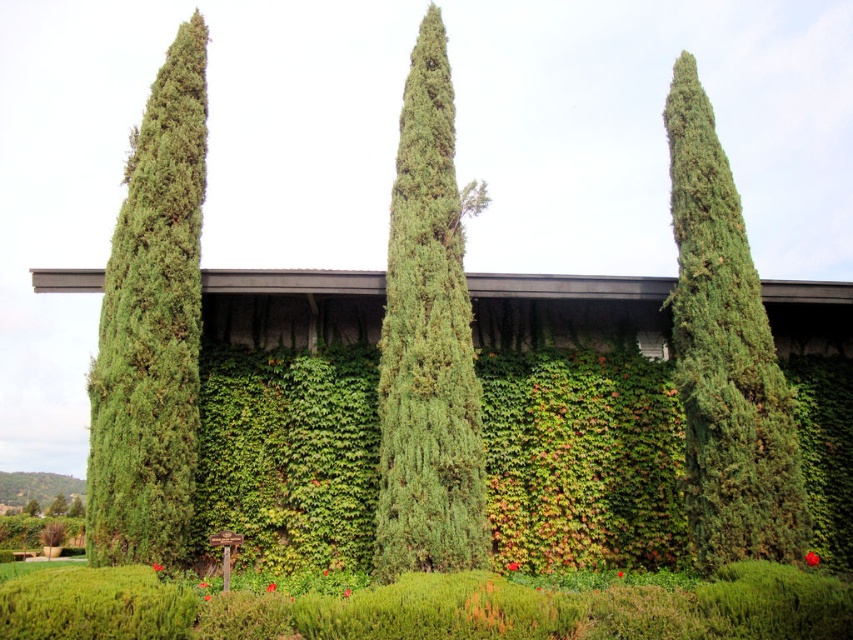
You are an architect designing a garden path between the green textured tree at left and the green textured tree at center. Which tree requires a wider base for the path due to its thickness?

The green textured tree at center requires a wider base for the path because it is thicker than the green textured tree at left.

You are a landscape architect designing a pathway between the green textured tree at left and the green leafy tree at center. If the pathway must be 2 meters wide, will there be enough space between them?

The green textured tree at left is narrower than the green leafy tree at center. However, the description only provides information about their widths relative to each other, not the exact distance between them. Without knowing the actual spacing between the trees, it is impossible to determine if the 2 meter pathway will fit.

You are standing in front of the modern building and see the green textured tree at left and the green textured tree at center. Which tree is located more to the left?

The green textured tree at left is more to the left side of the green textured tree at center.